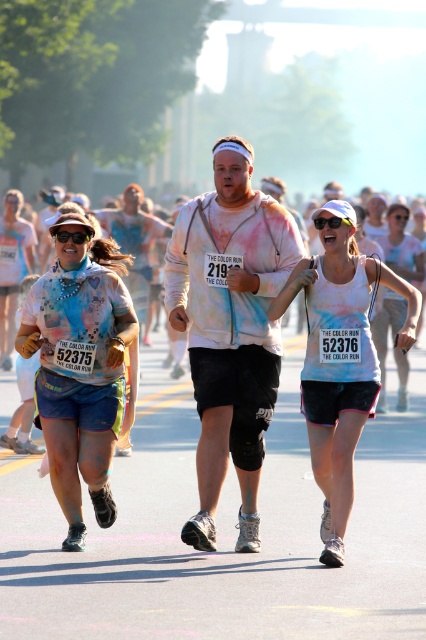
Does white matte tank top at center have a larger size compared to black plastic goggles at upper center?

Yes, white matte tank top at center is bigger than black plastic goggles at upper center.

Can you confirm if white matte tank top at center is wider than black plastic goggles at upper center?

Correct, the width of white matte tank top at center exceeds that of black plastic goggles at upper center.

Is point (403, 378) closer to camera compared to point (58, 230)?

No, it is behind (58, 230).

At what (x,y) coordinates should I click in order to perform the action: click on white matte tank top at center. Please return your answer as a coordinate pair (x, y). Looking at the image, I should click on (402, 246).

Which of these two, matte blue shorts at left or white matte tank top at center, stands taller?

matte blue shorts at left

This screenshot has width=426, height=640. Describe the element at coordinates (80, 369) in the screenshot. I see `matte blue shorts at left` at that location.

At what (x,y) coordinates should I click in order to perform the action: click on matte blue shorts at left. Please return your answer as a coordinate pair (x, y). The height and width of the screenshot is (640, 426). Looking at the image, I should click on (80, 369).

Measure the distance between matte blue shorts at left and camera.

matte blue shorts at left and camera are 7.80 meters apart.

Is matte blue shorts at left further to camera compared to white tie-dye tank top at center?

Yes, it is behind white tie-dye tank top at center.

Who is more forward, (x=94, y=248) or (x=342, y=248)?

Point (x=342, y=248) is more forward.

Locate an element on the screen. This screenshot has height=640, width=426. matte blue shorts at left is located at coordinates (80, 369).